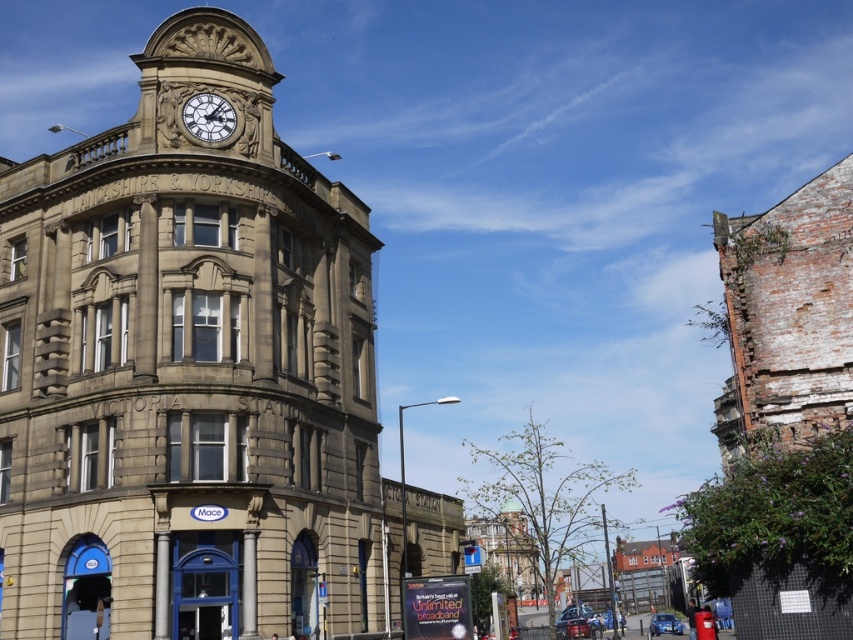
Question: Does brown stone clock tower at upper center appear on the left side of matte stone clock at upper center?

Choices:
 (A) yes
 (B) no

Answer: (A)

Question: Which of the following is the farthest from the observer?

Choices:
 (A) brown stone clock tower at upper center
 (B) matte stone clock at upper center

Answer: (B)

Question: Which of the following is the closest to the observer?

Choices:
 (A) brown stone clock tower at upper center
 (B) matte stone clock at upper center

Answer: (A)

Question: Does brown stone clock tower at upper center have a smaller size compared to matte stone clock at upper center?

Choices:
 (A) no
 (B) yes

Answer: (A)

Question: Can you confirm if brown stone clock tower at upper center is bigger than matte stone clock at upper center?

Choices:
 (A) yes
 (B) no

Answer: (A)

Question: Among these objects, which one is farthest from the camera?

Choices:
 (A) matte stone clock at upper center
 (B) brown stone clock tower at upper center

Answer: (A)